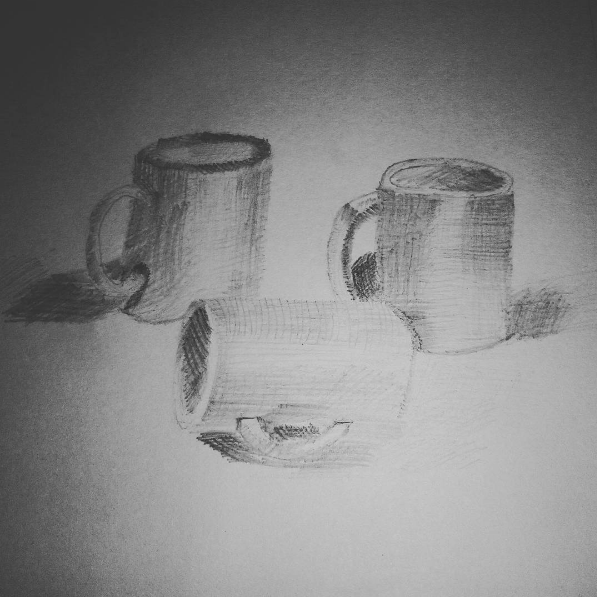
The width and height of the screenshot is (597, 597). What are the coordinates of `mug handles` in the screenshot? It's located at (293, 449), (94, 255), (340, 246).